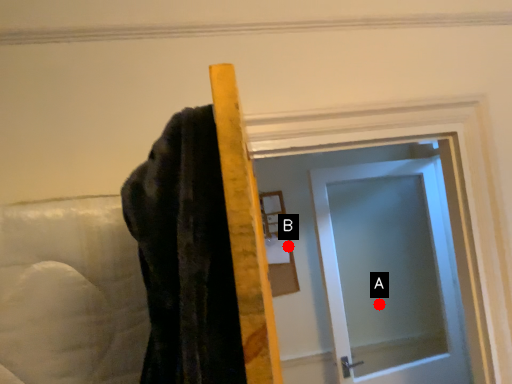
Question: Two points are circled on the image, labeled by A and B beside each circle. Among these points, which one is nearest to the camera?

Choices:
 (A) A is closer
 (B) B is closer

Answer: (B)